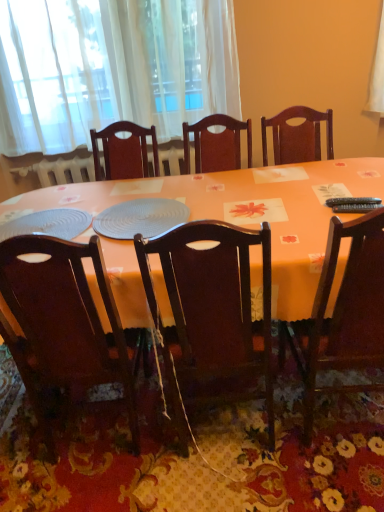
Find the location of a particular element. free point to the left of dark wood chair at lower left, the 3th chair when ordered from right to left is located at coordinates (22, 451).